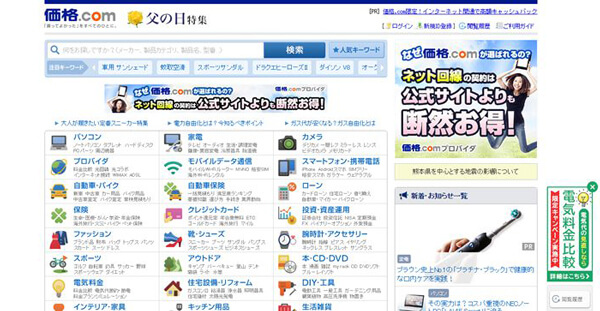
Where is `electric toothbrush`? The image size is (600, 311). electric toothbrush is located at coordinates point(488,240).